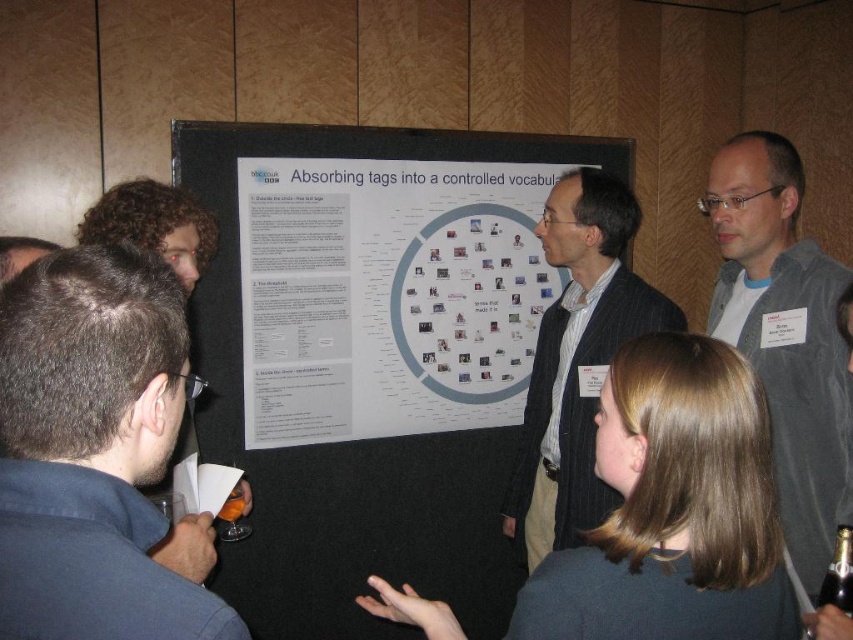
Question: Estimate the real-world distances between objects in this image. Which object is farther from the striped suit jacket at center?

Choices:
 (A) gray fabric jacket at right
 (B) dark blue shirt at lower left
 (C) white paperboard poster at center

Answer: (B)

Question: Is white paperboard poster at center above striped suit jacket at center?

Choices:
 (A) no
 (B) yes

Answer: (B)

Question: From the image, what is the correct spatial relationship of white paperboard poster at center in relation to gray fabric jacket at right?

Choices:
 (A) above
 (B) below

Answer: (A)

Question: Which point is farther from the camera taking this photo?

Choices:
 (A) (326, 435)
 (B) (791, 540)
 (C) (16, 524)

Answer: (A)

Question: Considering the real-world distances, which object is farthest from the gray fabric jacket at right?

Choices:
 (A) white paperboard at center
 (B) dark blue shirt at lower left
 (C) striped suit jacket at center
 (D) white paperboard poster at center

Answer: (B)

Question: Does white paperboard poster at center appear on the left side of striped suit jacket at center?

Choices:
 (A) no
 (B) yes

Answer: (B)